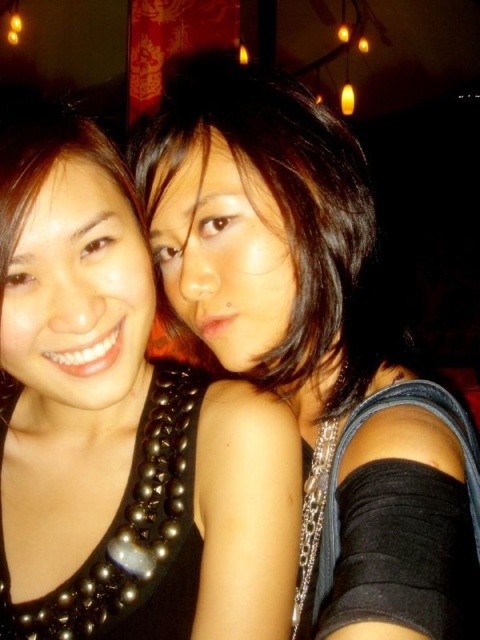
From the picture: Who is shorter, black pearl necklace at center or black beaded necklace at upper left?

With less height is black pearl necklace at center.

In the scene shown: Does black pearl necklace at center have a greater height compared to black beaded necklace at upper left?

In fact, black pearl necklace at center may be shorter than black beaded necklace at upper left.

Is point (55, 163) farther from viewer compared to point (252, 177)?

That is False.

Locate an element on the screen. The width and height of the screenshot is (480, 640). black pearl necklace at center is located at coordinates (122, 426).